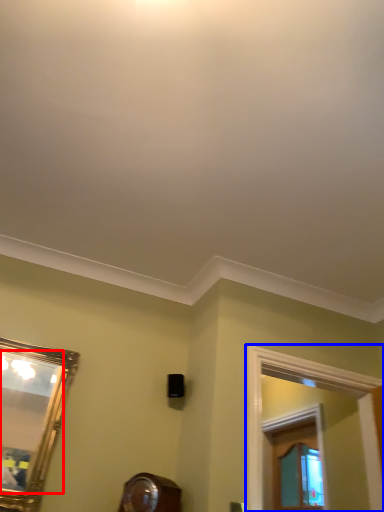
Question: Among these objects, which one is farthest to the camera, mirror (highlighted by a red box) or window frame (highlighted by a blue box)?

Choices:
 (A) mirror
 (B) window frame

Answer: (B)